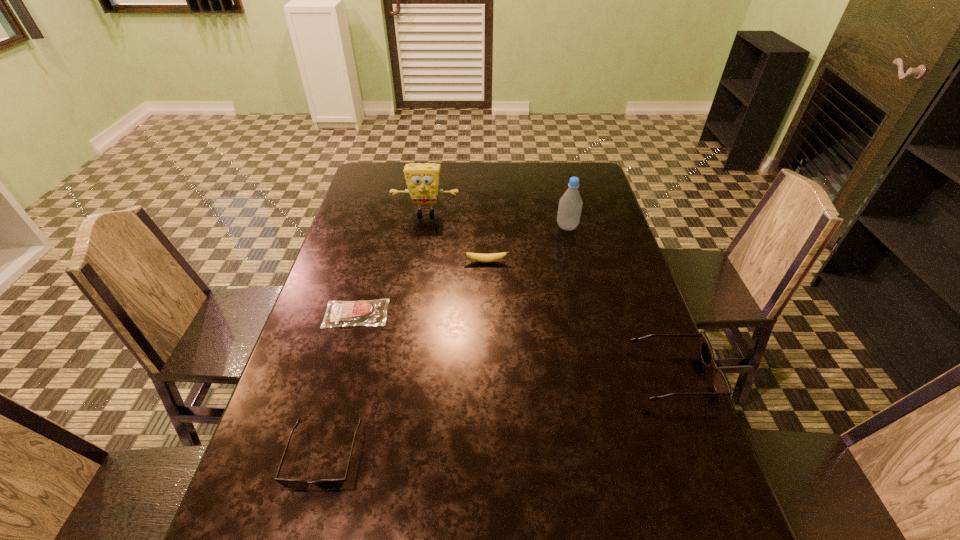
Locate an element on the screen. This screenshot has width=960, height=540. free space between the farthest object and the right sunglasses is located at coordinates (550, 294).

Find the location of `vacant area that lies between the farthest object and the third object from right to left`. vacant area that lies between the farthest object and the third object from right to left is located at coordinates (456, 238).

At what (x,y) coordinates should I click in order to perform the action: click on free space between the bottle and the third tallest object. Please return your answer as a coordinate pair (x, y). Looking at the image, I should click on (620, 301).

I want to click on vacant space that's between the fourth object from left to right and the left sunglasses, so click(405, 359).

Locate an element on the screen. The height and width of the screenshot is (540, 960). vacant space that is in between the fifth nearest object and the fifth tallest object is located at coordinates (527, 244).

The height and width of the screenshot is (540, 960). What are the coordinates of `blank region between the nearest object and the fifth object from left to right` in the screenshot? It's located at (445, 341).

Identify which object is located as the nearest to the fourth farthest object. Please provide its 2D coordinates. Your answer should be formatted as a tuple, i.e. [(x, y)], where the tuple contains the x and y coordinates of a point satisfying the conditions above.

[(479, 257)]

Identify which object is the fifth nearest to the farthest object. Please provide its 2D coordinates. Your answer should be formatted as a tuple, i.e. [(x, y)], where the tuple contains the x and y coordinates of a point satisfying the conditions above.

[(294, 484)]

Where is `vacant area that satisfies the following two spatial constraints: 1. on the back side of the second object from right to left; 2. on the left side of the third farthest object`? vacant area that satisfies the following two spatial constraints: 1. on the back side of the second object from right to left; 2. on the left side of the third farthest object is located at coordinates (486, 227).

This screenshot has width=960, height=540. I want to click on free spot that satisfies the following two spatial constraints: 1. on the back side of the second farthest object; 2. on the left side of the fourth object from left to right, so point(486,227).